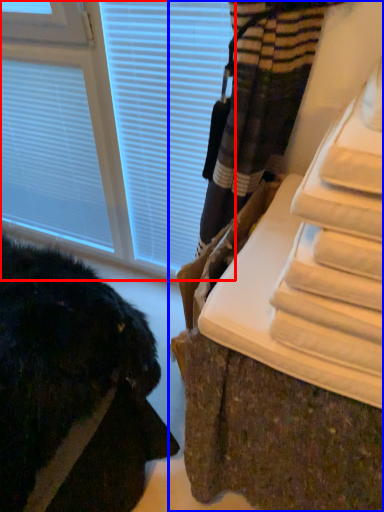
Question: Which object is further to the camera taking this photo, window (highlighted by a red box) or furniture (highlighted by a blue box)?

Choices:
 (A) window
 (B) furniture

Answer: (A)